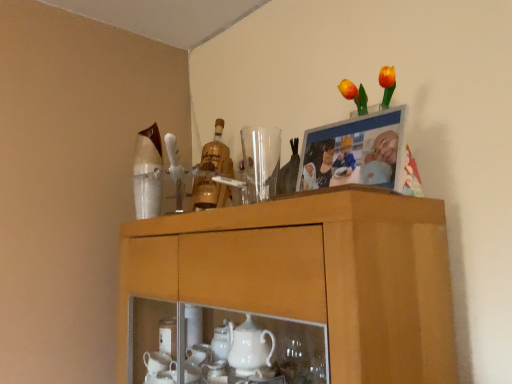
Question: Choose the correct answer: Is wooden cabinet at upper center inside transparent glass at upper center or outside it?

Choices:
 (A) inside
 (B) outside

Answer: (B)

Question: Is wooden cabinet at upper center wider or thinner than transparent glass at upper center?

Choices:
 (A) thin
 (B) wide

Answer: (B)

Question: Based on their relative distances, which object is farther from the transparent glass at upper center?

Choices:
 (A) gold glass bottle at center
 (B) wooden cabinet at upper center

Answer: (B)

Question: Which object is positioned farthest from the transparent glass at upper center?

Choices:
 (A) wooden cabinet at upper center
 (B) gold glass bottle at center

Answer: (A)